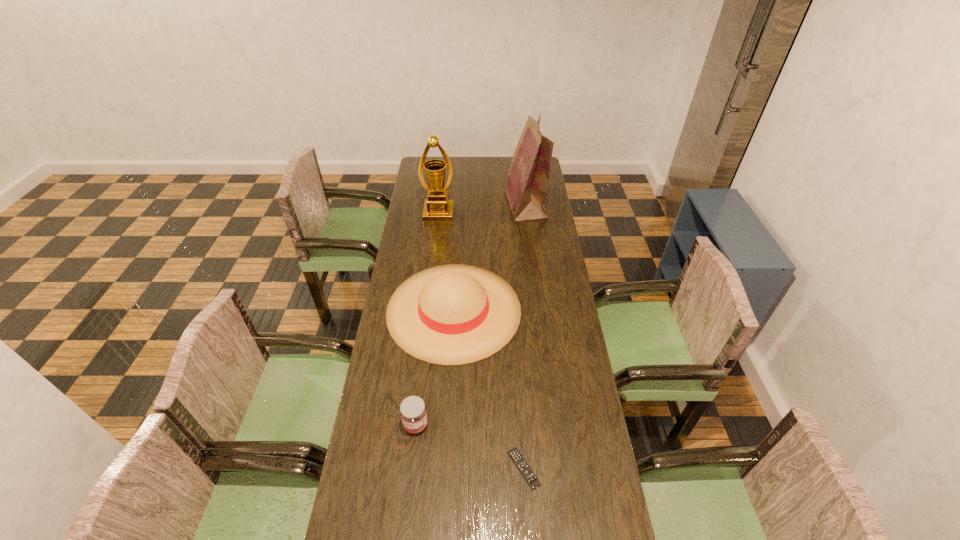
Locate an element on the screen. The image size is (960, 540). grocery bag is located at coordinates (526, 185).

The height and width of the screenshot is (540, 960). Find the location of `award`. award is located at coordinates click(437, 208).

Locate an element on the screen. the third nearest object is located at coordinates (454, 314).

Identify the location of the third tallest object. Image resolution: width=960 pixels, height=540 pixels. (454, 314).

Find the location of a particular element. The image size is (960, 540). the fourth tallest object is located at coordinates (413, 412).

At what (x,y) coordinates should I click in order to perform the action: click on the second nearest object. Please return your answer as a coordinate pair (x, y). Image resolution: width=960 pixels, height=540 pixels. Looking at the image, I should click on (413, 412).

The image size is (960, 540). I want to click on the nearest object, so click(x=515, y=455).

This screenshot has width=960, height=540. In order to click on remote control in this screenshot , I will do `click(515, 455)`.

Find the location of a particular element. This screenshot has width=960, height=540. free spot located on the front-facing side of the grocery bag is located at coordinates tap(480, 204).

The image size is (960, 540). What are the coordinates of `free location located on the front-facing side of the grocery bag` in the screenshot? It's located at (461, 204).